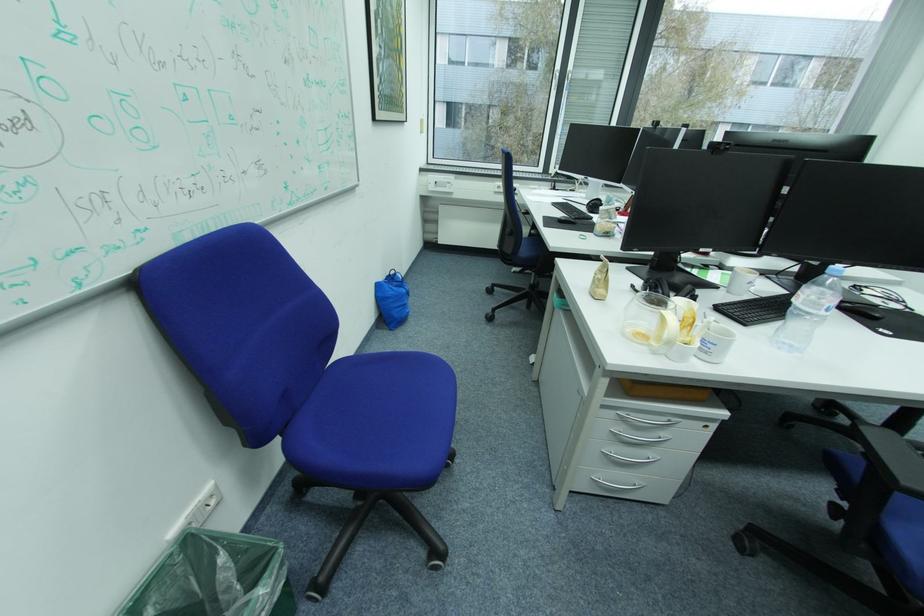
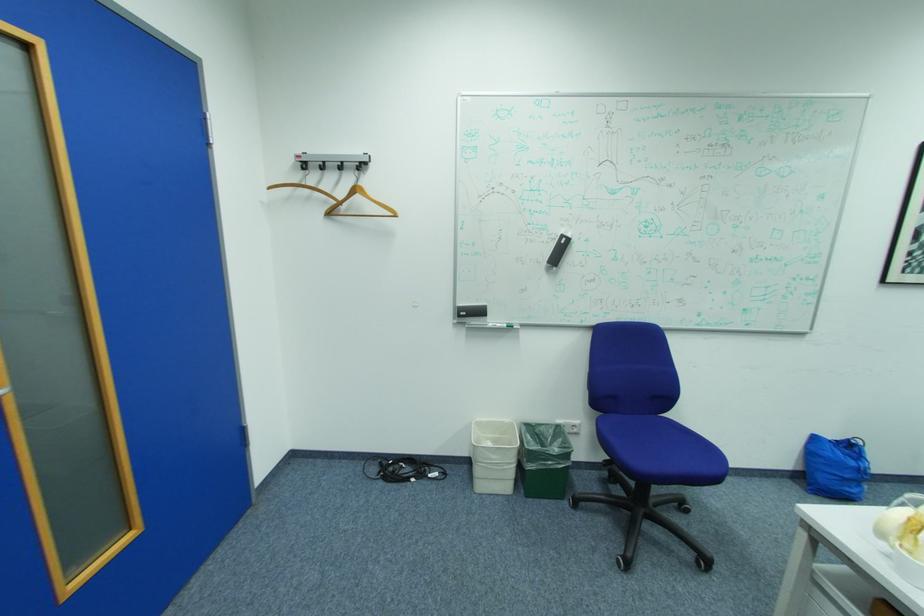
In the second image, find the point that corresponds to point 231,560 in the first image.

(568, 440)